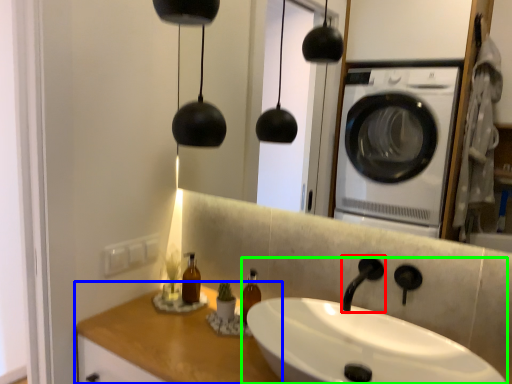
Question: Which is farther away from faucet (highlighted by a red box)? counter top (highlighted by a blue box) or sink (highlighted by a green box)?

Choices:
 (A) counter top
 (B) sink

Answer: (A)